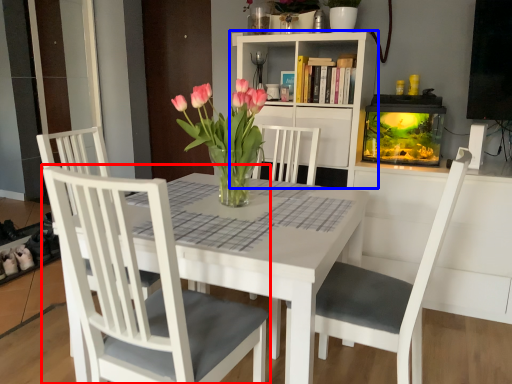
Question: Which object is closer to the camera taking this photo, chair (highlighted by a red box) or bookcase (highlighted by a blue box)?

Choices:
 (A) chair
 (B) bookcase

Answer: (A)